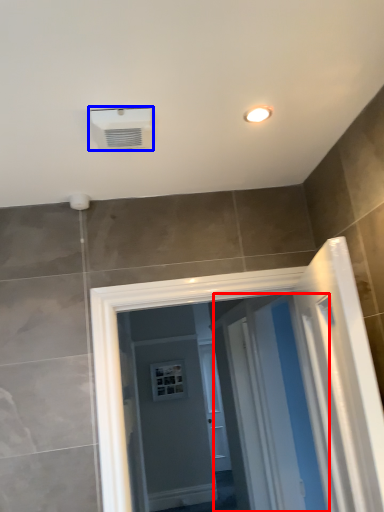
Question: Which object is closer to the camera taking this photo, screen door (highlighted by a red box) or air conditioning (highlighted by a blue box)?

Choices:
 (A) screen door
 (B) air conditioning

Answer: (B)